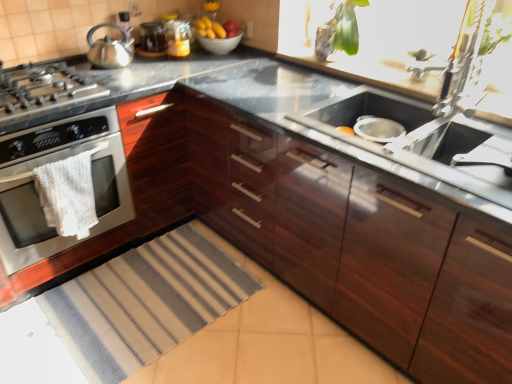
Question: From a real-world perspective, relative to white woven towel at left, is yellow matte bananas at upper center vertically above or below?

Choices:
 (A) above
 (B) below

Answer: (A)

Question: Relative to white woven towel at left, is yellow matte bananas at upper center in front or behind?

Choices:
 (A) front
 (B) behind

Answer: (B)

Question: Considering the real-world distances, which object is closest to the striped fabric rug at lower left?

Choices:
 (A) polished stainless steel kettle at left
 (B) matte glass jar at upper center
 (C) metallic silver faucet at upper right
 (D) stainless steel sink at center
 (E) white glossy bowl at upper center

Answer: (D)

Question: Which is nearer to the striped fabric rug at lower left?

Choices:
 (A) glossy wood cabinets at center
 (B) polished stainless steel kettle at left
 (C) white glossy bowl at upper center
 (D) white woven towel at left
 (E) metallic silver faucet at upper right

Answer: (D)